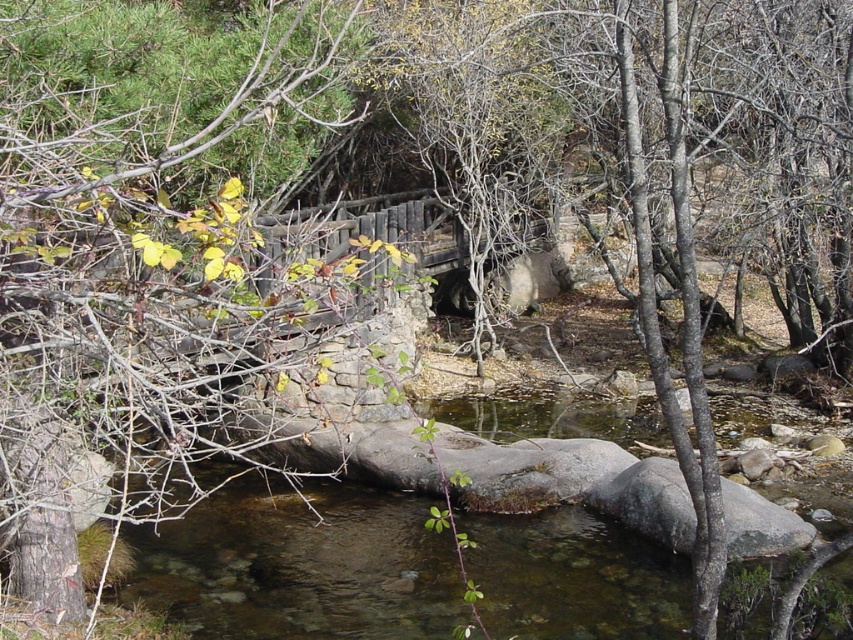
Question: Is green leafy branches at upper left to the left of clear water at center from the viewer's perspective?

Choices:
 (A) no
 (B) yes

Answer: (A)

Question: Is green leafy branches at upper left bigger than clear water at center?

Choices:
 (A) no
 (B) yes

Answer: (B)

Question: Which point appears closest to the camera in this image?

Choices:
 (A) (291, 588)
 (B) (0, 157)

Answer: (B)

Question: Is green leafy branches at upper left smaller than clear water at center?

Choices:
 (A) no
 (B) yes

Answer: (A)